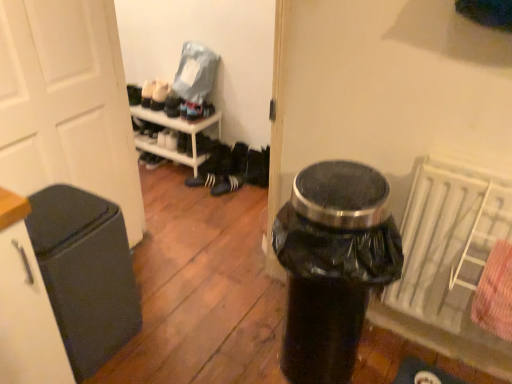
Question: Is black matte sneakers at center, the second footwear from the right, shorter than black matte trash can at left?

Choices:
 (A) no
 (B) yes

Answer: (B)

Question: Considering the relative sizes of black matte sneakers at center, the first footwear viewed from the left, and black matte trash can at left in the image provided, is black matte sneakers at center, the first footwear viewed from the left, thinner than black matte trash can at left?

Choices:
 (A) yes
 (B) no

Answer: (A)

Question: Is black matte sneakers at center, the second footwear from the right, facing away from black matte trash can at left?

Choices:
 (A) no
 (B) yes

Answer: (A)

Question: Considering the relative positions of black matte sneakers at center, the first footwear viewed from the left, and black matte trash can at left in the image provided, is black matte sneakers at center, the first footwear viewed from the left, to the left of black matte trash can at left from the viewer's perspective?

Choices:
 (A) no
 (B) yes

Answer: (A)

Question: Is black matte sneakers at center, the first footwear viewed from the left, not within black matte trash can at left?

Choices:
 (A) yes
 (B) no

Answer: (A)

Question: Is black matte trash can at left to the left or to the right of black matte sneakers at center, the first footwear viewed from the left, in the image?

Choices:
 (A) left
 (B) right

Answer: (A)

Question: Relative to black matte sneakers at center, the first footwear viewed from the left, is black matte trash can at left in front or behind?

Choices:
 (A) behind
 (B) front

Answer: (B)

Question: From the image's perspective, is black matte trash can at left positioned above or below black matte sneakers at center, the second footwear from the right?

Choices:
 (A) above
 (B) below

Answer: (B)

Question: Is black matte trash can at left taller or shorter than black matte sneakers at center, the second footwear from the right?

Choices:
 (A) tall
 (B) short

Answer: (A)

Question: From a real-world perspective, is black matte sneakers at center, the first footwear viewed from the left, physically located above or below white matte door at left?

Choices:
 (A) below
 (B) above

Answer: (A)

Question: In terms of height, does black matte sneakers at center, the first footwear viewed from the left, look taller or shorter compared to white matte door at left?

Choices:
 (A) tall
 (B) short

Answer: (B)

Question: Based on their positions, is black matte sneakers at center, the second footwear from the right, located to the left or right of white matte door at left?

Choices:
 (A) left
 (B) right

Answer: (B)

Question: Looking at their shapes, would you say black matte sneakers at center, the second footwear from the right, is wider or thinner than white matte door at left?

Choices:
 (A) wide
 (B) thin

Answer: (B)

Question: Considering the positions of point (242, 180) and point (54, 306), is point (242, 180) closer or farther from the camera than point (54, 306)?

Choices:
 (A) farther
 (B) closer

Answer: (A)

Question: Considering the positions of black suede sneakers at center, placed as the 2th footwear when sorted from left to right, and black matte trash can at left in the image, is black suede sneakers at center, placed as the 2th footwear when sorted from left to right, taller or shorter than black matte trash can at left?

Choices:
 (A) short
 (B) tall

Answer: (A)